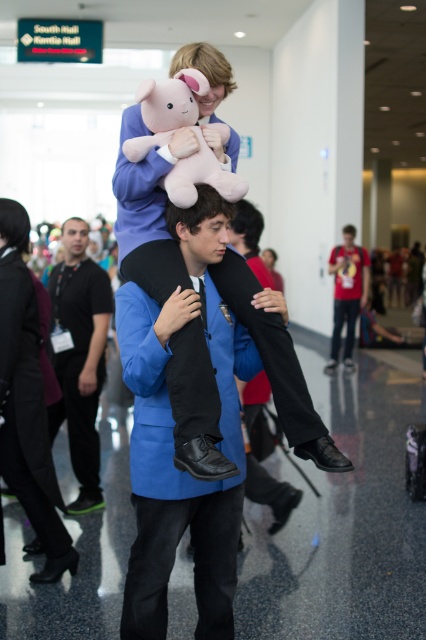
Question: Which of the following is the closest to the observer?

Choices:
 (A) (359, 260)
 (B) (74, 390)

Answer: (B)

Question: Can you confirm if black matte shirt at center is positioned to the right of denim pants at center?

Choices:
 (A) yes
 (B) no

Answer: (B)

Question: Does black matte shirt at center come in front of denim pants at center?

Choices:
 (A) no
 (B) yes

Answer: (B)

Question: Among these objects, which one is nearest to the camera?

Choices:
 (A) black matte shirt at center
 (B) denim pants at center

Answer: (A)

Question: Is the position of black matte shirt at center more distant than that of denim pants at center?

Choices:
 (A) yes
 (B) no

Answer: (B)